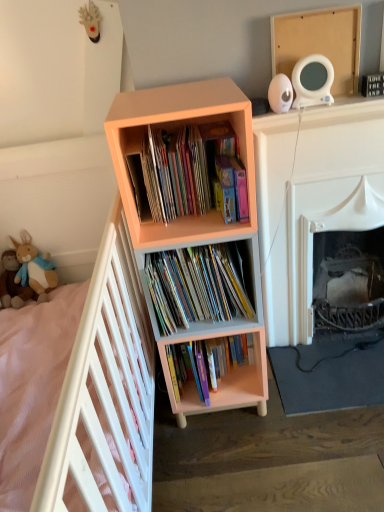
This screenshot has height=512, width=384. Find the location of `vacant point above peach matte bookcase at center (from a real-world perspective)`. vacant point above peach matte bookcase at center (from a real-world perspective) is located at coordinates (170, 93).